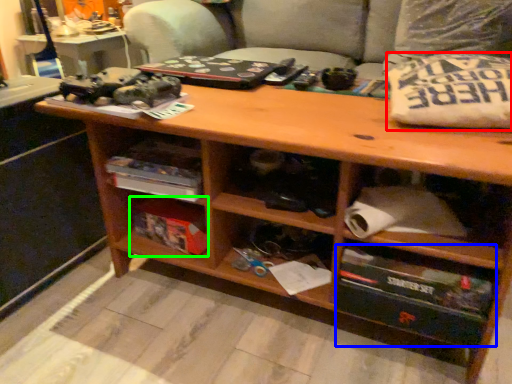
Question: Which is nearer to the pillow (highlighted by a red box)? drawer (highlighted by a blue box) or box (highlighted by a green box).

Choices:
 (A) drawer
 (B) box

Answer: (A)